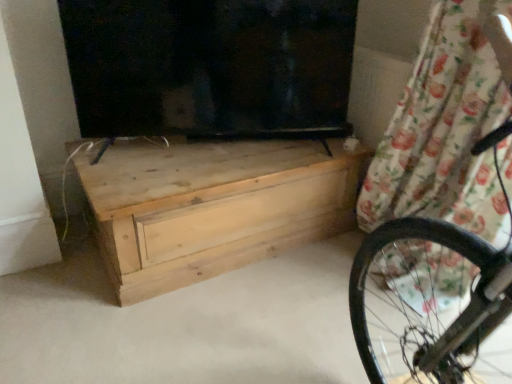
Question: In the image, is natural wood chest of drawers at center on the left side or the right side of floral fabric curtain at upper right?

Choices:
 (A) left
 (B) right

Answer: (A)

Question: Considering the positions of point (267, 253) and point (426, 196), is point (267, 253) closer or farther from the camera than point (426, 196)?

Choices:
 (A) closer
 (B) farther

Answer: (B)

Question: From the image's perspective, relative to floral fabric curtain at upper right, is natural wood chest of drawers at center above or below?

Choices:
 (A) below
 (B) above

Answer: (A)

Question: Which is correct: floral fabric curtain at upper right is inside natural wood chest of drawers at center, or outside of it?

Choices:
 (A) outside
 (B) inside

Answer: (A)

Question: Is point (438, 256) positioned closer to the camera than point (271, 140)?

Choices:
 (A) farther
 (B) closer

Answer: (B)

Question: From a real-world perspective, is floral fabric curtain at upper right above or below natural wood chest of drawers at center?

Choices:
 (A) below
 (B) above

Answer: (B)

Question: Looking at their shapes, would you say floral fabric curtain at upper right is wider or thinner than natural wood chest of drawers at center?

Choices:
 (A) thin
 (B) wide

Answer: (A)